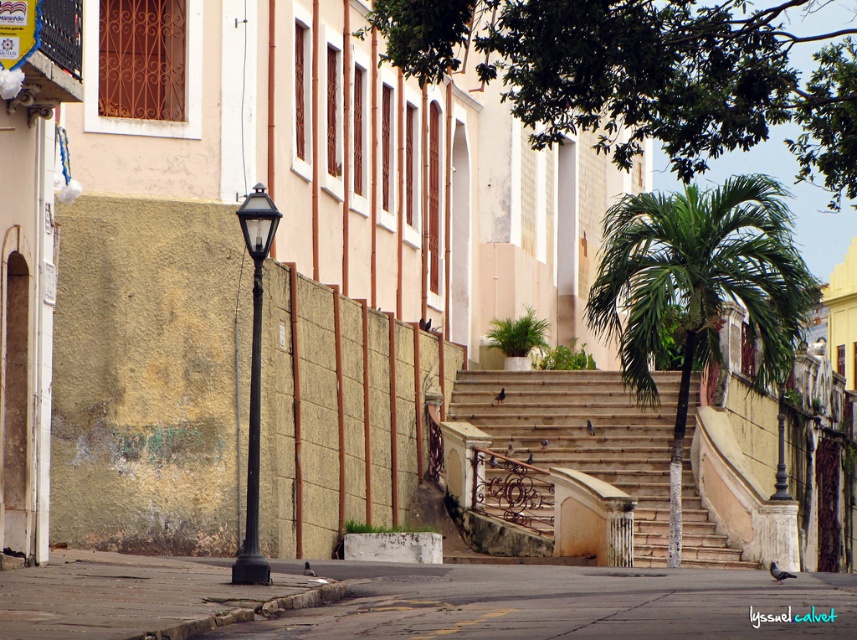
Where is `stone stairs at center`? The image size is (857, 640). stone stairs at center is located at coordinates (582, 433).

Is point (718, 292) in front of point (261, 292)?

No, it is not.

Is green leafy palm tree at center positioned behind black metal/texture lamp post at left?

That is True.

Which is behind, point (676, 538) or point (255, 570)?

Point (676, 538)

The width and height of the screenshot is (857, 640). I want to click on green leafy palm tree at center, so click(697, 291).

Based on the photo, can you confirm if green leafy palm tree at center is positioned below stone stairs at center?

No.

Describe the element at coordinates (697, 291) in the screenshot. I see `green leafy palm tree at center` at that location.

Is point (684, 314) positioned in front of point (550, 428)?

That is True.

Locate an element on the screen. The image size is (857, 640). green leafy palm tree at center is located at coordinates (697, 291).